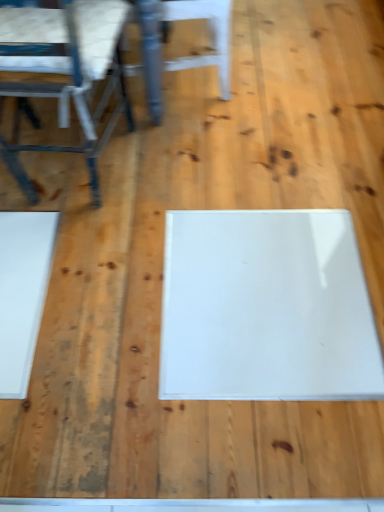
Question: In terms of size, does white glossy chair at upper center, which appears as the 1th chair when viewed from the right, appear bigger or smaller than metallic blue chair at left, acting as the first chair starting from the left?

Choices:
 (A) small
 (B) big

Answer: (A)

Question: Would you say white glossy chair at upper center, which appears as the second chair when viewed from the left, is inside or outside metallic blue chair at left, acting as the first chair starting from the left?

Choices:
 (A) outside
 (B) inside

Answer: (A)

Question: In terms of width, does white glossy chair at upper center, which appears as the 1th chair when viewed from the right, look wider or thinner when compared to metallic blue chair at left, which is the second chair in right-to-left order?

Choices:
 (A) wide
 (B) thin

Answer: (B)

Question: Is metallic blue chair at left, acting as the first chair starting from the left, situated inside white glossy chair at upper center, which appears as the second chair when viewed from the left, or outside?

Choices:
 (A) outside
 (B) inside

Answer: (A)

Question: Considering the positions of metallic blue chair at left, which is the second chair in right-to-left order, and white glossy chair at upper center, which appears as the second chair when viewed from the left, in the image, is metallic blue chair at left, which is the second chair in right-to-left order, wider or thinner than white glossy chair at upper center, which appears as the second chair when viewed from the left,?

Choices:
 (A) wide
 (B) thin

Answer: (A)

Question: From a real-world perspective, relative to white glossy chair at upper center, which appears as the second chair when viewed from the left, is metallic blue chair at left, which is the second chair in right-to-left order, vertically above or below?

Choices:
 (A) below
 (B) above

Answer: (B)

Question: Is metallic blue chair at left, which is the second chair in right-to-left order, taller or shorter than white glossy chair at upper center, which appears as the second chair when viewed from the left?

Choices:
 (A) tall
 (B) short

Answer: (A)